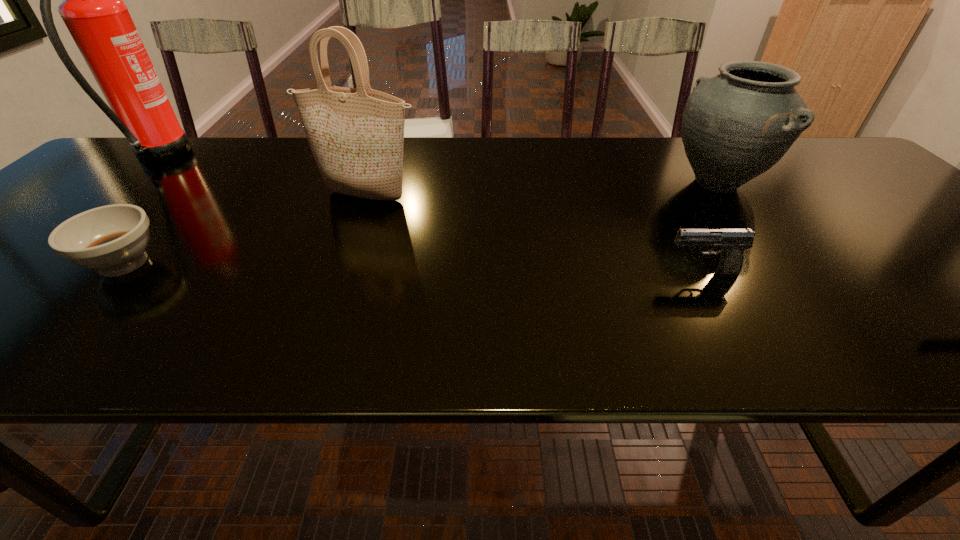
Find the location of a particular element. This screenshot has height=540, width=960. free space located aim along the barrel of the pistol is located at coordinates (636, 272).

You are a GUI agent. You are given a task and a screenshot of the screen. Output one action in this format:
    pyautogui.click(x=<x>, y=<y>)
    Task: Click on the vacant space located 0.150m aim along the barrel of the pistol
    The height and width of the screenshot is (540, 960).
    Given the screenshot: What is the action you would take?
    pyautogui.click(x=589, y=272)

Where is `vacant space situated 0.360m aim along the barrel of the pistol`? vacant space situated 0.360m aim along the barrel of the pistol is located at coordinates (484, 272).

Where is `free point located on the back of the soup bowl`? This screenshot has height=540, width=960. free point located on the back of the soup bowl is located at coordinates (162, 221).

Find the location of a particular element. fire extinguisher located at the far edge is located at coordinates (93, 10).

This screenshot has height=540, width=960. What are the coordinates of `urn that is at the far edge` in the screenshot? It's located at (735, 126).

At what (x,y) coordinates should I click in order to perform the action: click on object that is positioned at the left edge. Please return your answer as a coordinate pair (x, y). The width and height of the screenshot is (960, 540). Looking at the image, I should click on (93, 10).

Image resolution: width=960 pixels, height=540 pixels. Find the location of `object at the far left corner`. object at the far left corner is located at coordinates (93, 10).

The width and height of the screenshot is (960, 540). Find the location of `vacant space at the far edge of the desktop`. vacant space at the far edge of the desktop is located at coordinates (192, 139).

Image resolution: width=960 pixels, height=540 pixels. What are the coordinates of `free region at the near edge of the desktop` in the screenshot? It's located at (234, 322).